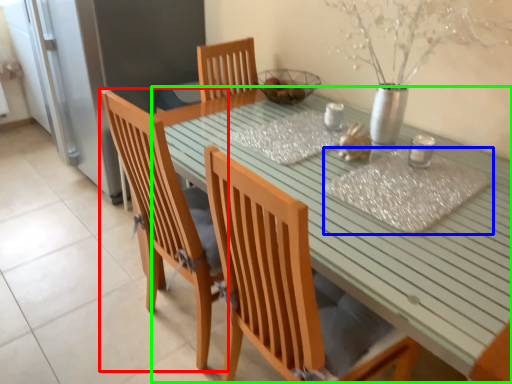
Question: Estimate the real-world distances between objects in this image. Which object is farther from chair (highlighted by a red box), place mat (highlighted by a blue box) or table (highlighted by a green box)?

Choices:
 (A) place mat
 (B) table

Answer: (A)